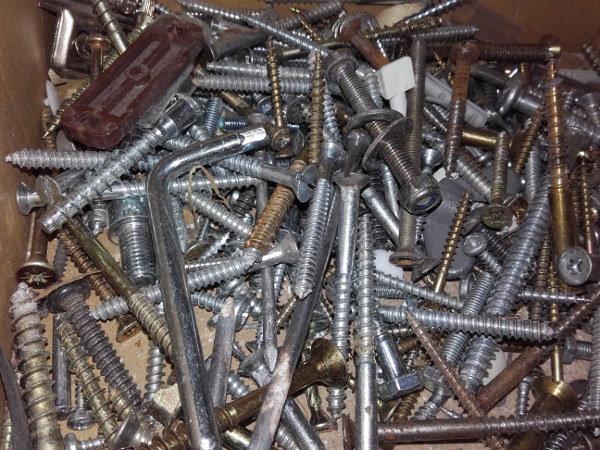
This screenshot has height=450, width=600. I want to click on black screw, so click(x=238, y=206), click(x=559, y=439).